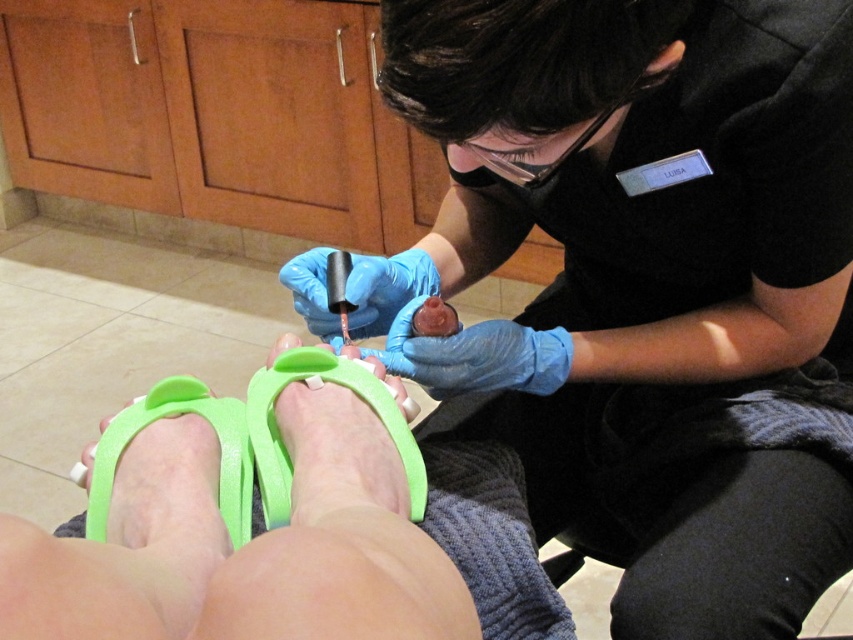
You are a customer at a salon and see the green rubber sandals at lower center and the green rubber foot at lower center. Which object is closer to the floor?

The green rubber sandals at lower center are closer to the floor because they are positioned below the green rubber foot at lower center.

You are a customer at a salon and see the green rubber foot at lower left and the glossy nail polish at center. Which object is positioned to the left of the other?

The green rubber foot at lower left is to the left of glossy nail polish at center.

You are a delivery robot that needs to place a small package between the green rubber sandals at lower center and the green rubber foot at lower left. Can you fit the package there if it measures 10 centimeters in length?

The distance between the green rubber sandals at lower center and the green rubber foot at lower left is 10.55 centimeters. Since the package is 10 centimeters long, it should fit comfortably within the space.